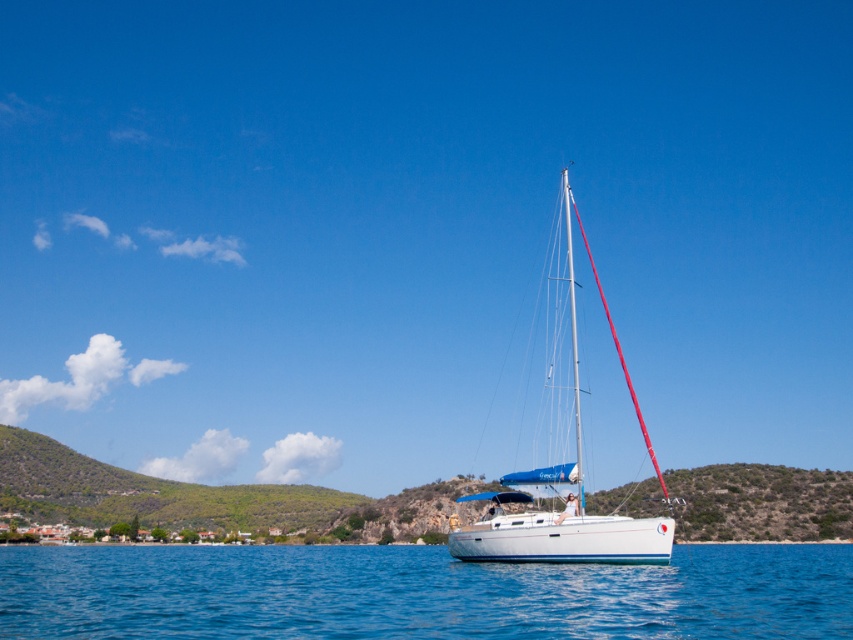
Which is above, blue water at center or white glossy sailboat at center?

white glossy sailboat at center

You are a GUI agent. You are given a task and a screenshot of the screen. Output one action in this format:
    pyautogui.click(x=<x>, y=<y>)
    Task: Click on the blue water at center
    This screenshot has width=853, height=640.
    Given the screenshot: What is the action you would take?
    pyautogui.click(x=419, y=593)